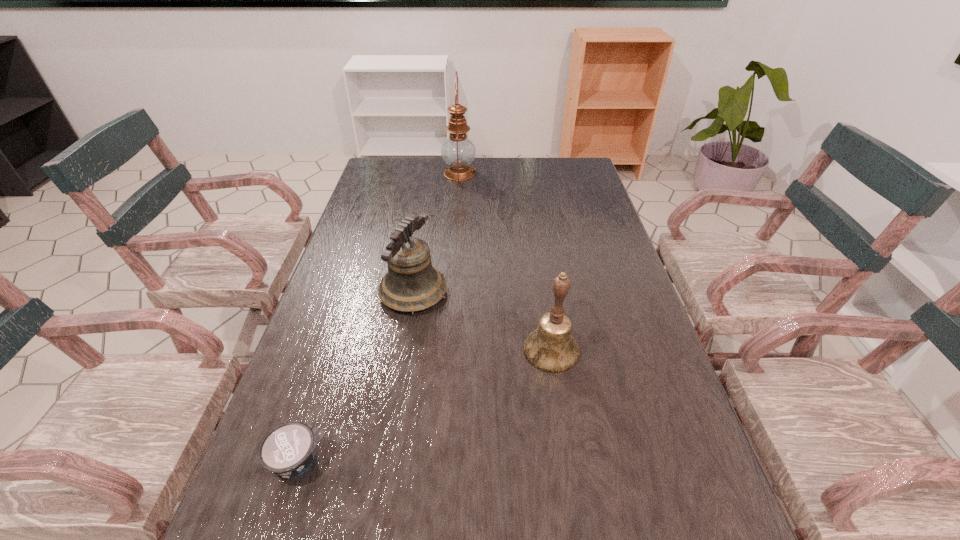
Image resolution: width=960 pixels, height=540 pixels. What are the coordinates of `free spot located 0.310m on the back of the farther bell` in the screenshot? It's located at (427, 210).

Where is `free spot located on the back of the leftmost object`? This screenshot has height=540, width=960. free spot located on the back of the leftmost object is located at coordinates (326, 373).

This screenshot has width=960, height=540. Identify the location of object that is at the far edge. (458, 151).

This screenshot has height=540, width=960. Find the location of `bell present at the left edge`. bell present at the left edge is located at coordinates (412, 284).

I want to click on yogurt positioned at the left edge, so click(288, 450).

At what (x,y) coordinates should I click in order to perform the action: click on vacant space at the far edge. Please return your answer as a coordinate pair (x, y). The image size is (960, 540). Looking at the image, I should click on (428, 171).

In the image, there is a desktop. Where is `free space at the left edge`? This screenshot has width=960, height=540. free space at the left edge is located at coordinates (258, 502).

Locate an element on the screen. This screenshot has width=960, height=540. vacant space at the right edge of the desktop is located at coordinates (643, 445).

In order to click on free space at the far right corner of the desktop in this screenshot , I will do `click(569, 176)`.

Find the location of a particular element. This screenshot has width=960, height=540. free spot between the oil lamp and the third nearest object is located at coordinates (437, 233).